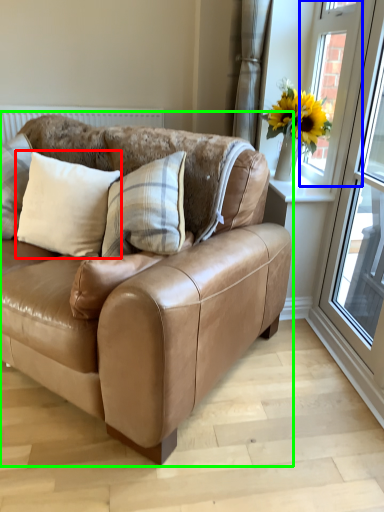
Question: Which object is the closest to the pillow (highlighted by a red box)? Choose among these: window (highlighted by a blue box) or studio couch (highlighted by a green box).

Choices:
 (A) window
 (B) studio couch

Answer: (B)